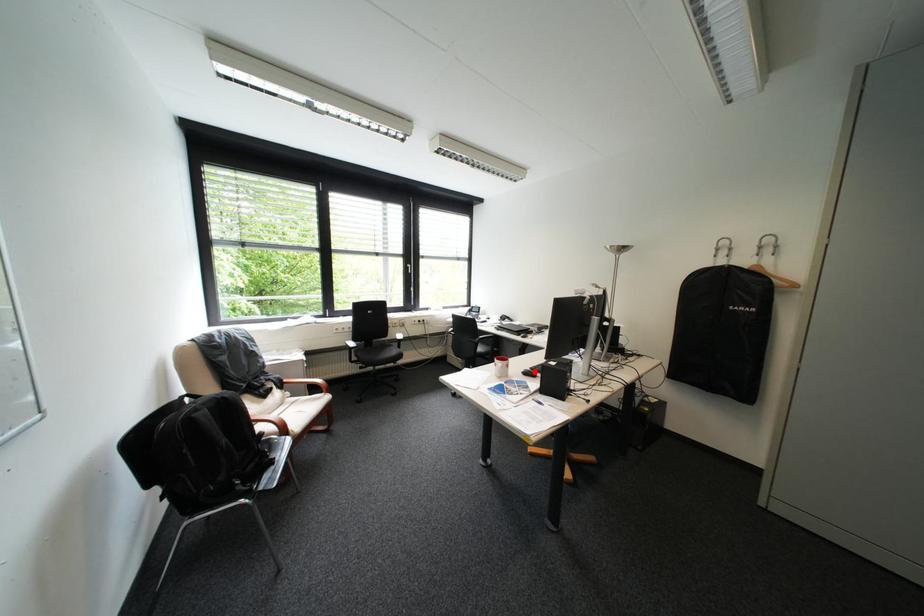
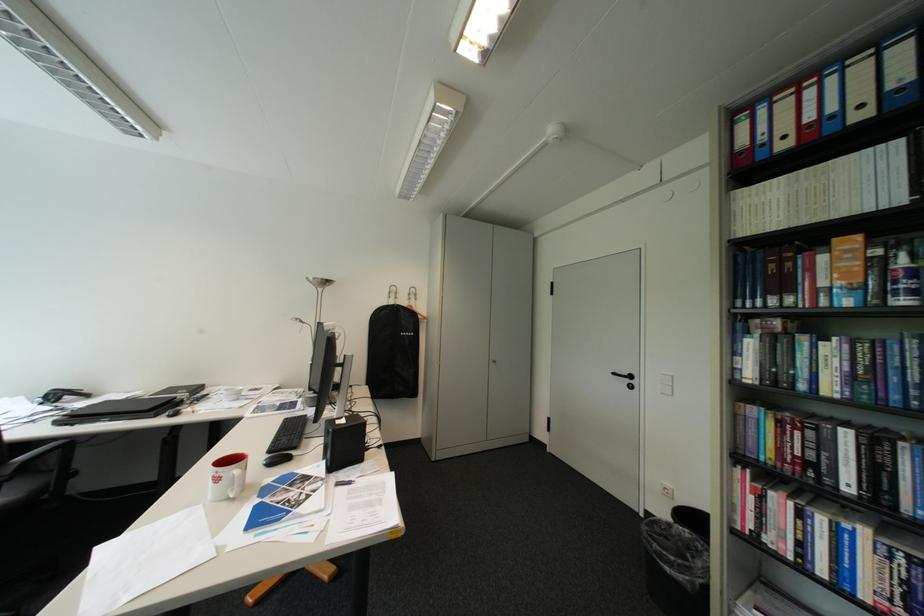
Question: I am providing you with two images of the same scene from different viewpoints. In image1, a red point is highlighted. Considering the same 3D point in image2, which of the following is correct?

Choices:
 (A) It is closer
 (B) It is farther

Answer: (B)